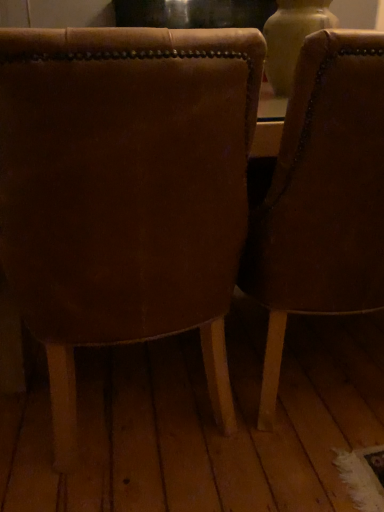
Question: Considering the positions of leather chair at center, placed as the second chair when sorted from left to right, and leather chair at center, which appears as the second chair when viewed from the right, in the image, is leather chair at center, placed as the second chair when sorted from left to right, taller or shorter than leather chair at center, which appears as the second chair when viewed from the right,?

Choices:
 (A) tall
 (B) short

Answer: (A)

Question: Considering the positions of point (382, 133) and point (79, 163), is point (382, 133) closer or farther from the camera than point (79, 163)?

Choices:
 (A) closer
 (B) farther

Answer: (B)

Question: Is leather chair at center, placed as the second chair when sorted from left to right, in front of or behind leather chair at center, which appears as the second chair when viewed from the right, in the image?

Choices:
 (A) front
 (B) behind

Answer: (B)

Question: Relative to leather chair at center, placed as the second chair when sorted from left to right, is leather chair at center, the first chair positioned from the left, in front or behind?

Choices:
 (A) behind
 (B) front

Answer: (B)

Question: Do you think leather chair at center, which appears as the second chair when viewed from the right, is within leather chair at center, which ranks as the first chair in right-to-left order, or outside of it?

Choices:
 (A) outside
 (B) inside

Answer: (A)

Question: Considering the relative positions of leather chair at center, which appears as the second chair when viewed from the right, and leather chair at center, placed as the second chair when sorted from left to right, in the image provided, is leather chair at center, which appears as the second chair when viewed from the right, to the left or to the right of leather chair at center, placed as the second chair when sorted from left to right,?

Choices:
 (A) right
 (B) left

Answer: (B)

Question: From the image's perspective, relative to leather chair at center, which ranks as the first chair in right-to-left order, is leather chair at center, which appears as the second chair when viewed from the right, above or below?

Choices:
 (A) above
 (B) below

Answer: (B)